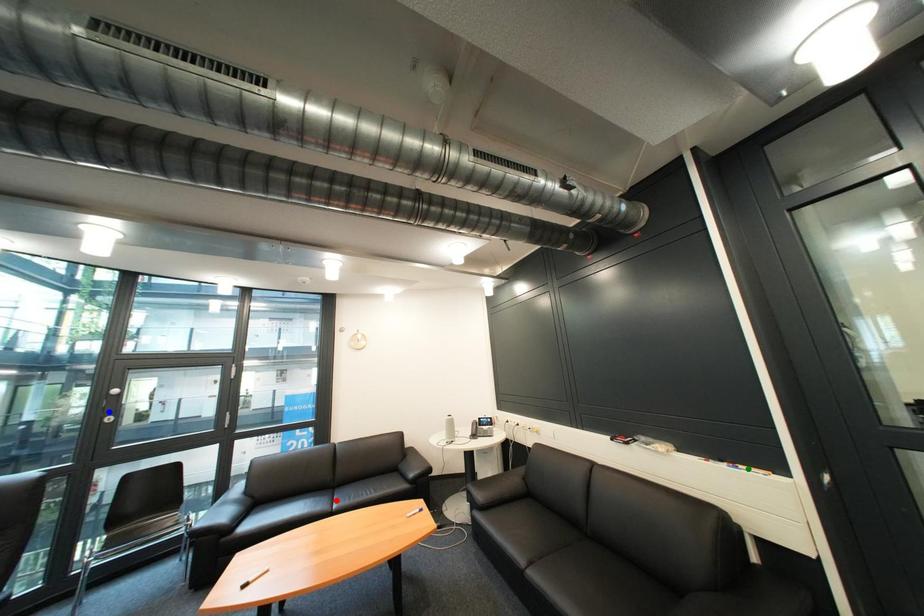
Order these from nearest to farthest:
A) red point
B) blue point
C) green point

green point
red point
blue point